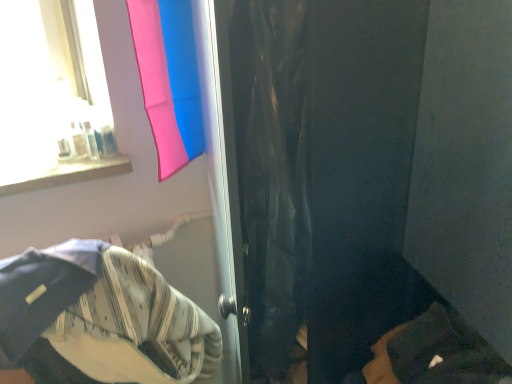
The height and width of the screenshot is (384, 512). What do you see at coordinates (101, 319) in the screenshot? I see `striped fabric bed at lower left` at bounding box center [101, 319].

Locate an element on the screen. This screenshot has width=512, height=384. striped fabric bed at lower left is located at coordinates (101, 319).

Locate an element on the screen. striped fabric bed at lower left is located at coordinates (101, 319).